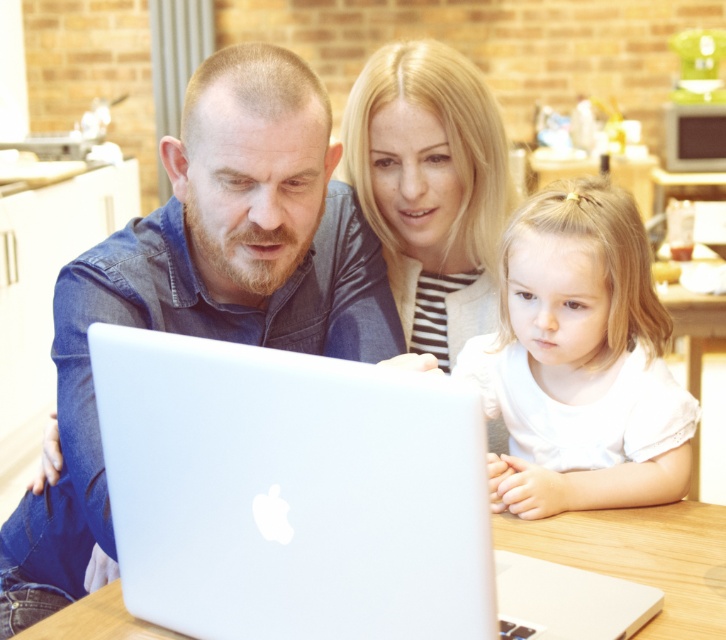
Question: From the image, what is the correct spatial relationship of silver metallic laptop at center in relation to blonde hair at upper center?

Choices:
 (A) below
 (B) above

Answer: (A)

Question: Among these points, which one is nearest to the camera?

Choices:
 (A) (4, 560)
 (B) (644, 636)
 (C) (428, 627)
 (D) (510, 320)

Answer: (C)

Question: Which point is farther to the camera?

Choices:
 (A) (711, 525)
 (B) (208, 147)
 (C) (513, 364)

Answer: (C)

Question: Is matte blue shirt at center to the right of blonde hair at upper center from the viewer's perspective?

Choices:
 (A) yes
 (B) no

Answer: (B)

Question: Can you confirm if matte blue shirt at center is positioned above blonde hair at upper center?

Choices:
 (A) yes
 (B) no

Answer: (B)

Question: Among these points, which one is nearest to the camera?

Choices:
 (A) (441, 276)
 (B) (518, 429)
 (C) (656, 561)

Answer: (C)